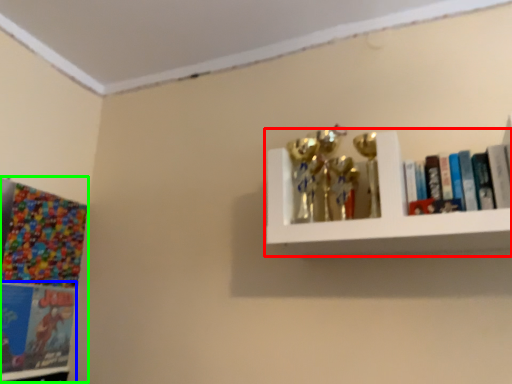
Question: Estimate the real-world distances between objects in this image. Which object is closer to shelf (highlighted by a red box), book (highlighted by a blue box) or comic book (highlighted by a green box)?

Choices:
 (A) book
 (B) comic book

Answer: (B)